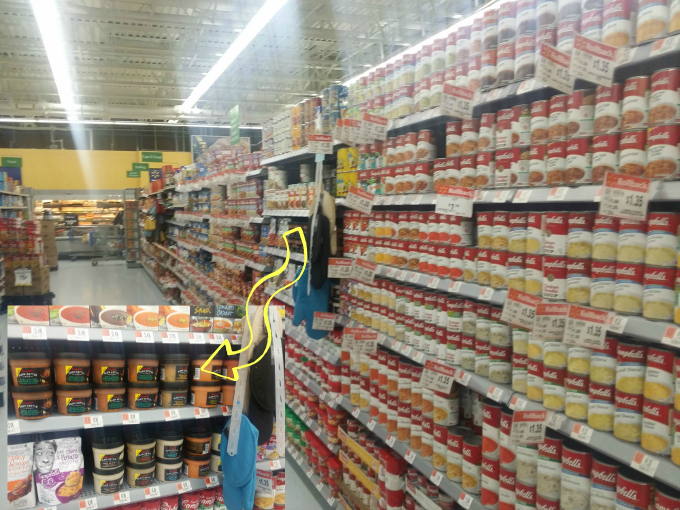
The width and height of the screenshot is (680, 510). I want to click on ceiling, so click(154, 80).